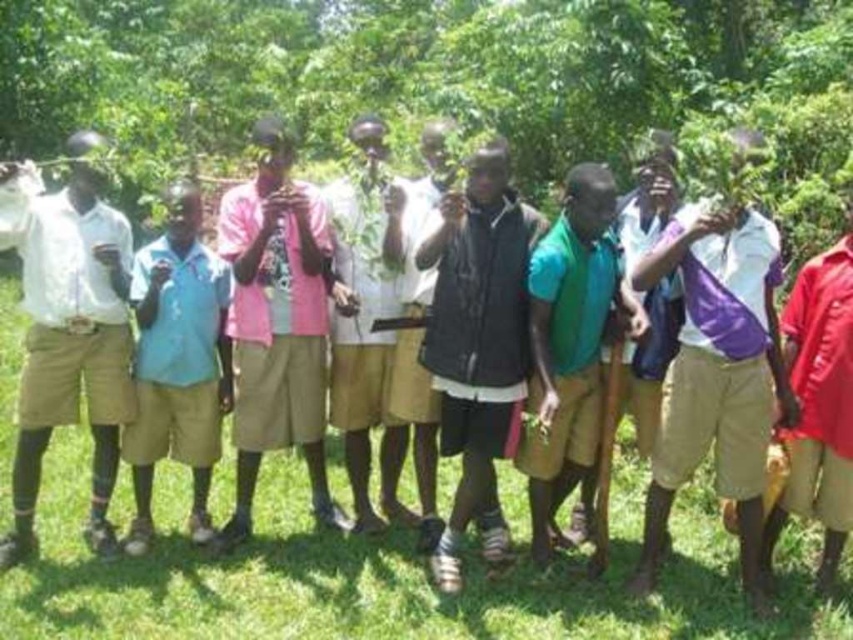
From the picture: Which is more to the left, pink cotton shirt at center or black matte vest at center?

Positioned to the left is pink cotton shirt at center.

Consider the image. Does pink cotton shirt at center appear on the left side of black matte vest at center?

Correct, you'll find pink cotton shirt at center to the left of black matte vest at center.

Which is in front, point (289, 147) or point (503, 376)?

Point (503, 376) is in front.

Locate an element on the screen. pink cotton shirt at center is located at coordinates (277, 323).

Is green leafy tree at center further to camera compared to pink cotton shirt at center?

No.

Consider the image. Can you confirm if green leafy tree at center is positioned to the left of pink cotton shirt at center?

Indeed, green leafy tree at center is positioned on the left side of pink cotton shirt at center.

Is point (735, 17) behind point (271, 273)?

Yes, point (735, 17) is behind point (271, 273).

You are a GUI agent. You are given a task and a screenshot of the screen. Output one action in this format:
    pyautogui.click(x=<x>, y=<y>)
    Task: Click on the green leafy tree at center
    The width and height of the screenshot is (853, 640).
    Given the screenshot: What is the action you would take?
    [444, 84]

Between point (759, 195) and point (171, 381), which one is positioned in front?

Point (759, 195)

Between green leafy tree at center and light blue fabric shirt at left, which one appears on the left side from the viewer's perspective?

green leafy tree at center

Does point (276, 90) come farther from viewer compared to point (223, 332)?

Yes, point (276, 90) is behind point (223, 332).

Where is `green leafy tree at center`? green leafy tree at center is located at coordinates (444, 84).